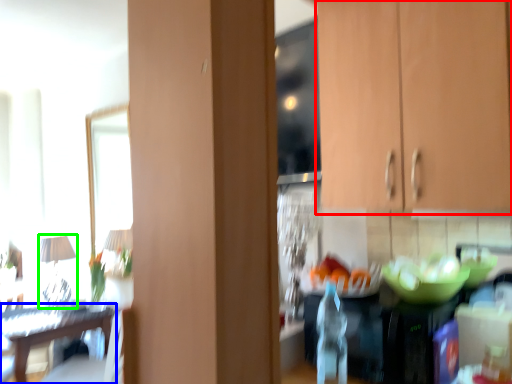
Question: Which object is the farthest from cabinetry (highlighted by a red box)? Choose among these: table (highlighted by a blue box) or lamp (highlighted by a green box).

Choices:
 (A) table
 (B) lamp

Answer: (B)